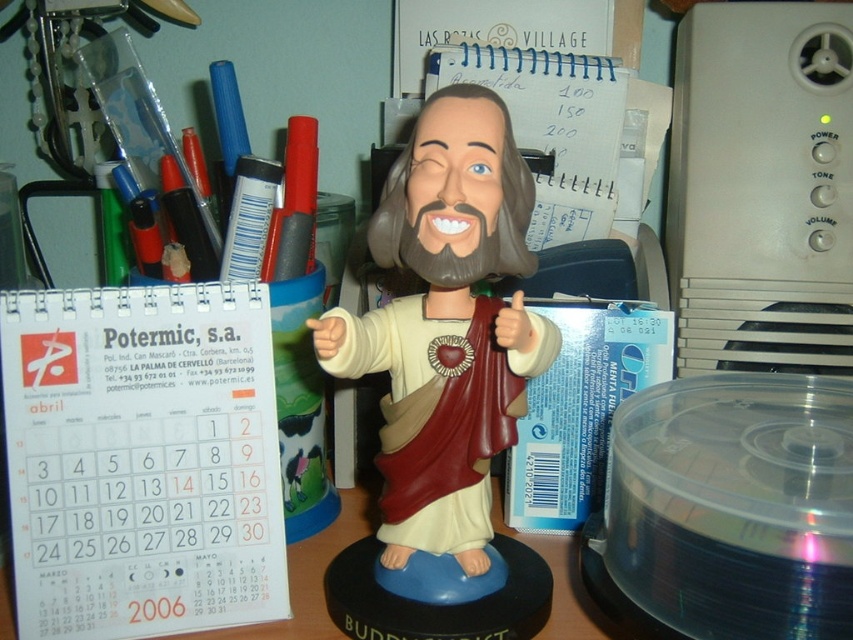
You are organizing items on a desk and need to know which object takes up more physical space. Based on the scene, which item is larger in size between the white paper calendar at left and the matte plastic bobblehead at center?

The matte plastic bobblehead at center is larger in size than the white paper calendar at left.

You are organizing items on a desk and see the white paper calendar at left and the white paper calendar at center. Which calendar is positioned lower on the desk?

The white paper calendar at left is located below the white paper calendar at center, so it is positioned lower on the desk.

You are organizing the items on the desk. You need to place the white paper calendar at left and the matte plastic bobblehead at center in a way that the calendar is visible. Is the current arrangement allowing the calendar to be seen?

The white paper calendar at left is positioned under the matte plastic bobblehead at center, so it is currently blocked and not fully visible. To make the calendar visible, you should move it to a position where it is not underneath the bobblehead.